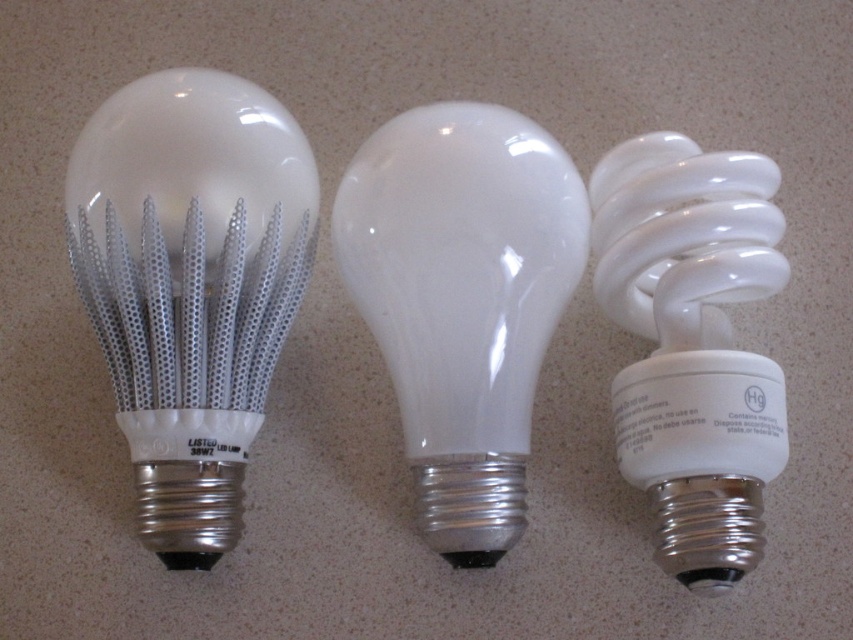
You are organizing a display and need to place a decorative item between the matte white bulb at center and the white glossy spiral bulb at right. What is the minimum width the item should have to fit between them?

The minimum width the item should have is 13.87 centimeters to fit between the matte white bulb at center and the white glossy spiral bulb at right.

You are a technician trying to replace the white metallic led bulb at left. The point marked at coordinates (190,284) indicates its location. If you move 0.1 units to the right along the x axis, will you still be on the white metallic led bulb at left?

The point at (190,284) marks the white metallic led bulb at left. Moving 0.1 units to the right along the x axis would take you to 0.545, which is beyond the bulb since the bulb is at the leftmost position. Therefore, you would no longer be on the white metallic led bulb at left.